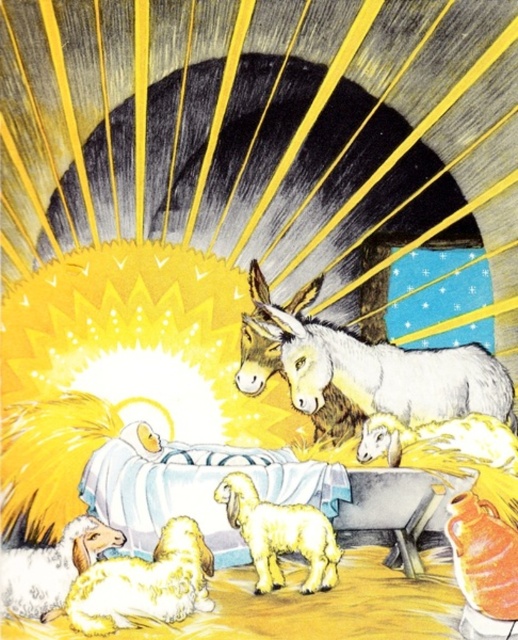
You are a shepherd in the nativity scene holding a measuring tape. You want to know if the distance between the white textured donkey at center and the fluffy white lamb at center is more than 18 inches. What is your observation?

The distance between the white textured donkey at center and the fluffy white lamb at center is 18.46 inches, which is more than 18 inches.

You are a shepherd trying to guide your flock to the manger. You see the fluffy white sheep at lower left and the fluffy white lamb at center. Can you walk between them without getting too close? The path between them must be at least 6 inches wide for you to pass safely.

The distance between the fluffy white sheep at lower left and the fluffy white lamb at center is 7.29 inches, which is wider than the required 6 inches. Therefore, you can safely walk between them without getting too close.